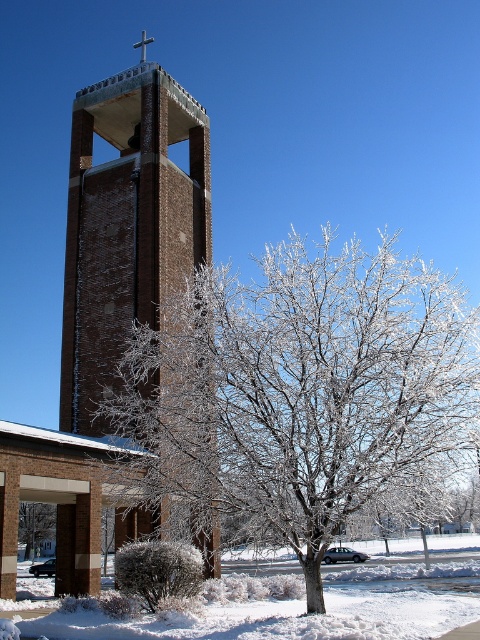
Looking at this image, you are standing at the base of the tall brick bell tower and want to walk to the frosted white tree at center. In which direction should you head?

You should head to the left since the frosted white tree at center is positioned at point (300,388), which is to the left of the tower.

You are standing in front of the bell tower on a snowy day. There are two points marked in the image, point 1 at coordinates point (x=411, y=380) and point 2 at coordinates point (x=54, y=515). Which point is closer to you?

Point (x=411, y=380) is closer to the camera than point (x=54, y=515).